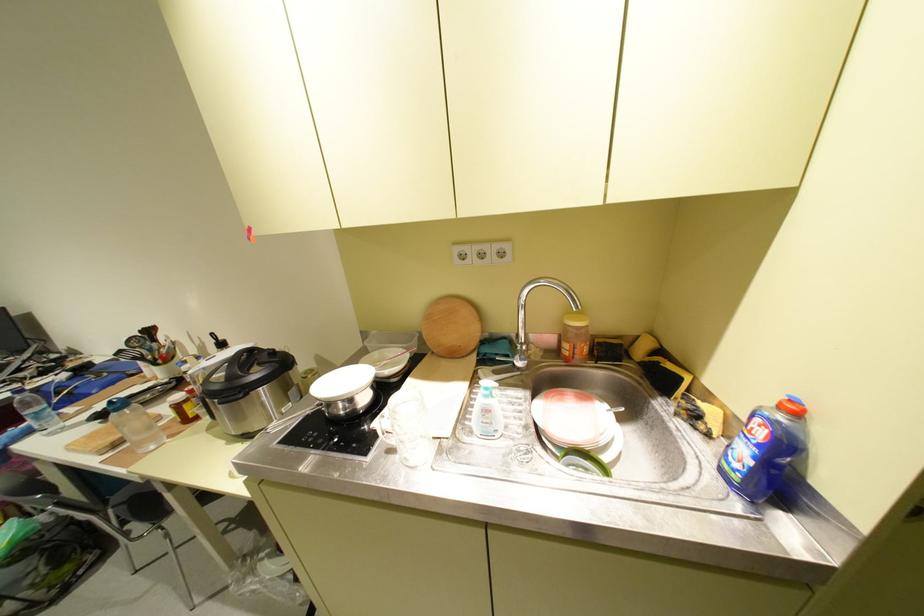
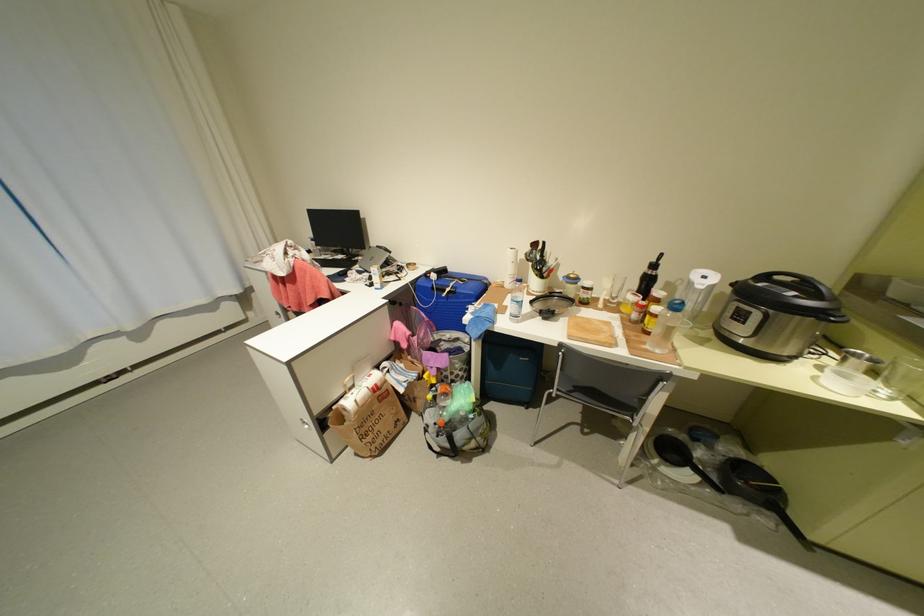
Where in the second image is the point corresponding to the point at 300,572 from the first image?

(711, 484)